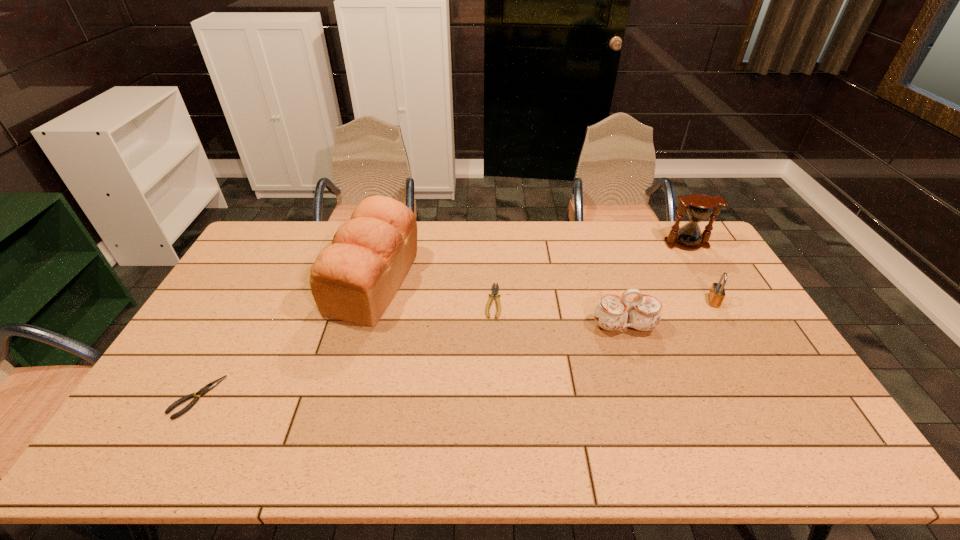
This screenshot has width=960, height=540. I want to click on vacant space that satisfies the following two spatial constraints: 1. on the front side of the right pliers; 2. on the right side of the second object from left to right, so click(x=370, y=301).

Where is `free space in the image that satisfies the following two spatial constraints: 1. on the back side of the farther pliers; 2. on the left side of the nearest object`? Image resolution: width=960 pixels, height=540 pixels. free space in the image that satisfies the following two spatial constraints: 1. on the back side of the farther pliers; 2. on the left side of the nearest object is located at coordinates (251, 301).